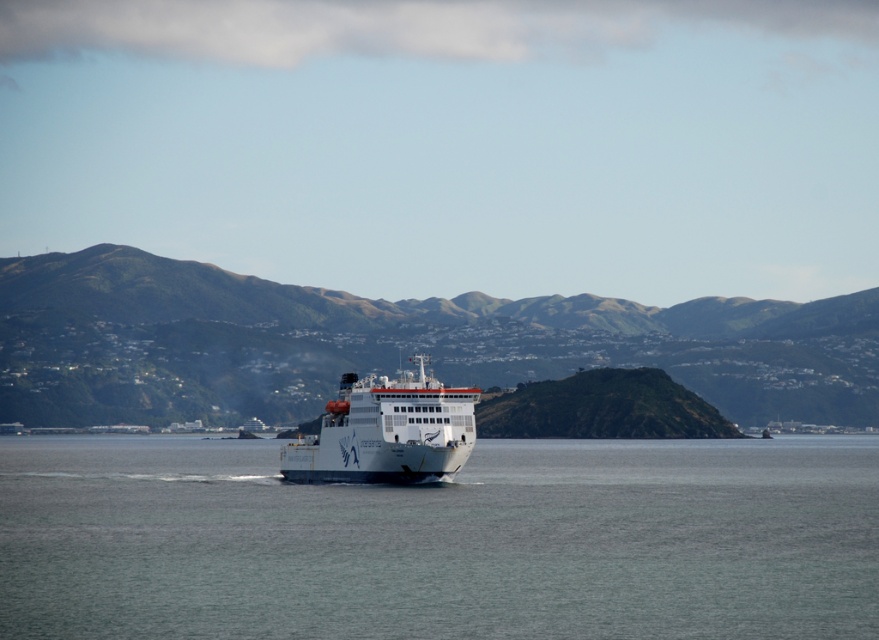
Who is lower down, clear water at center or white glossy ship at center?

clear water at center

Between point (498, 541) and point (407, 449), which one is positioned behind?

Positioned behind is point (407, 449).

Is point (792, 520) less distant than point (405, 422)?

Yes.

Locate an element on the screen. clear water at center is located at coordinates (441, 541).

Which is in front, point (180, 556) or point (74, 257)?

Positioned in front is point (180, 556).

Between clear water at center and green grassy hill at center, which one is positioned higher?

green grassy hill at center

Is point (622, 504) positioned behind point (54, 360)?

No, (622, 504) is in front of (54, 360).

Locate an element on the screen. clear water at center is located at coordinates (441, 541).

Can you confirm if green grassy hill at center is thinner than white glossy ship at center?

No.

Can you confirm if green grassy hill at center is wider than white glossy ship at center?

Indeed, green grassy hill at center has a greater width compared to white glossy ship at center.

Is point (362, 305) in front of point (367, 461)?

No, it is behind (367, 461).

Identify the location of green grassy hill at center. point(389,342).